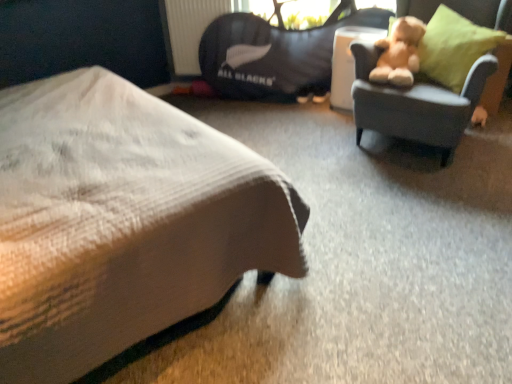
Question: From a real-world perspective, is soft gray fabric chair at upper right physically located above or below black fabric bean bag at upper center?

Choices:
 (A) above
 (B) below

Answer: (A)

Question: From the image's perspective, is soft gray fabric chair at upper right above or below black fabric bean bag at upper center?

Choices:
 (A) below
 (B) above

Answer: (A)

Question: Which is nearer to the soft gray fabric chair at upper right?

Choices:
 (A) black fabric bean bag at upper center
 (B) fluffy beige teddy bear at upper right
 (C) white textured bed at lower left
 (D) green fabric pillow at right

Answer: (B)

Question: Estimate the real-world distances between objects in this image. Which object is farther from the black fabric bean bag at upper center?

Choices:
 (A) fluffy beige teddy bear at upper right
 (B) soft gray fabric chair at upper right
 (C) green fabric pillow at right
 (D) white textured bed at lower left

Answer: (D)